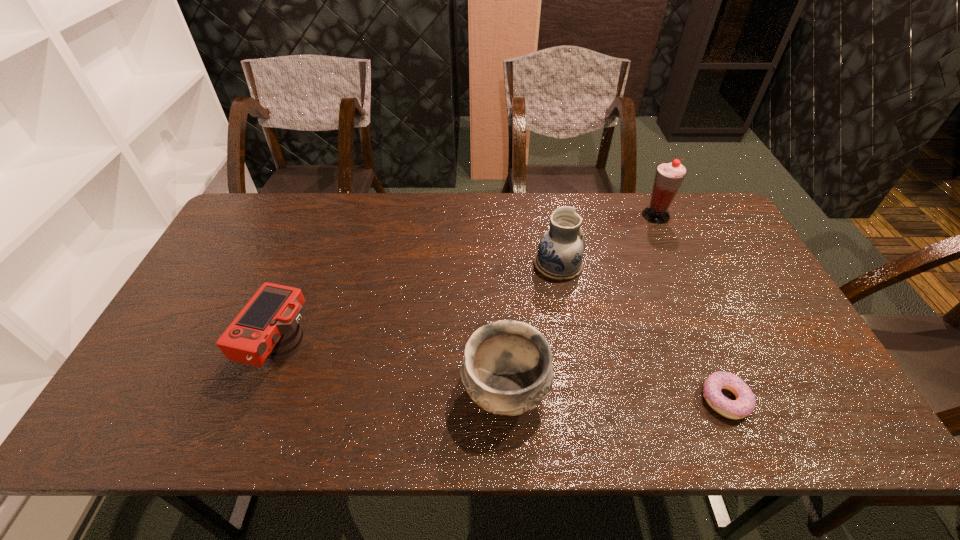
The width and height of the screenshot is (960, 540). Find the location of `the fourth closest object to the farther pottery`. the fourth closest object to the farther pottery is located at coordinates (268, 326).

Choose which object is the nearest neighbor to the doughnut. Please provide its 2D coordinates. Your answer should be formatted as a tuple, i.e. [(x, y)], where the tuple contains the x and y coordinates of a point satisfying the conditions above.

[(507, 369)]

This screenshot has height=540, width=960. Identify the location of vacant position in the image that satisfies the following two spatial constraints: 1. on the front side of the leftmost object; 2. on the left side of the shortest object. click(x=265, y=399).

This screenshot has height=540, width=960. I want to click on vacant space that satisfies the following two spatial constraints: 1. on the front side of the shortest object; 2. on the right side of the nearer pottery, so click(x=506, y=399).

This screenshot has height=540, width=960. In order to click on free space that satisfies the following two spatial constraints: 1. on the back side of the smoothie; 2. on the right side of the leftmost object in this screenshot , I will do `click(333, 215)`.